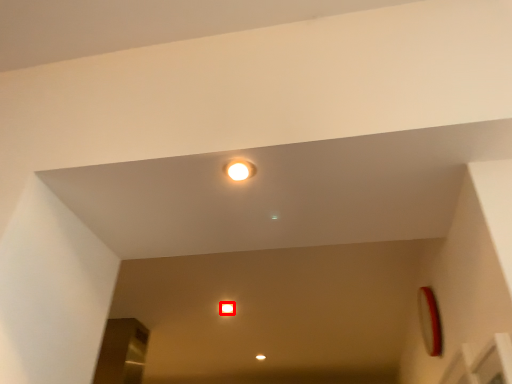
Question: Considering the relative positions of dot (annotated by the red box) and light in the image provided, where is dot (annotated by the red box) located with respect to the staircase?

Choices:
 (A) left
 (B) right

Answer: (A)